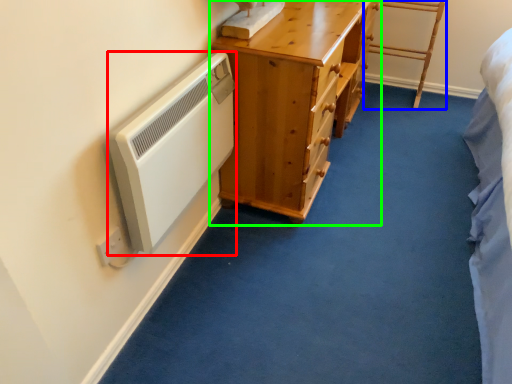
Question: Which object is the closest to the appliance (highlighted by a red box)? Choose among these: furniture (highlighted by a blue box) or chest of drawers (highlighted by a green box).

Choices:
 (A) furniture
 (B) chest of drawers

Answer: (B)